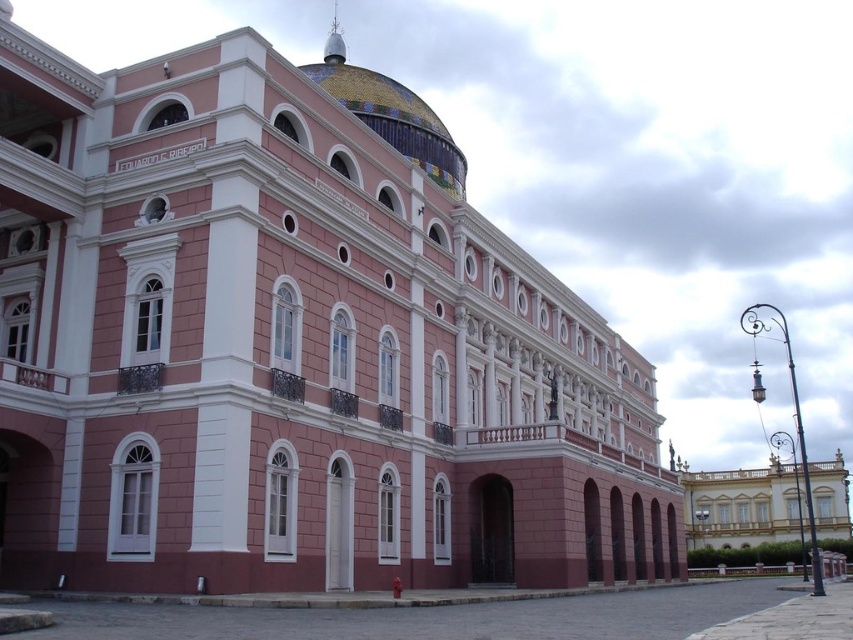
Question: Does golden ornate palace at right have a lesser width compared to multicolored mosaic dome at upper center?

Choices:
 (A) no
 (B) yes

Answer: (A)

Question: Which point is farther to the camera?

Choices:
 (A) golden ornate palace at right
 (B) multicolored mosaic dome at upper center

Answer: (A)

Question: Which point is farther from the camera taking this photo?

Choices:
 (A) (730, 476)
 (B) (386, 124)

Answer: (A)

Question: Does golden ornate palace at right appear under multicolored mosaic dome at upper center?

Choices:
 (A) yes
 (B) no

Answer: (A)

Question: From the image, what is the correct spatial relationship of golden ornate palace at right in relation to multicolored mosaic dome at upper center?

Choices:
 (A) left
 (B) right

Answer: (B)

Question: Which point is farther from the camera taking this photo?

Choices:
 (A) (380, 125)
 (B) (747, 483)

Answer: (B)